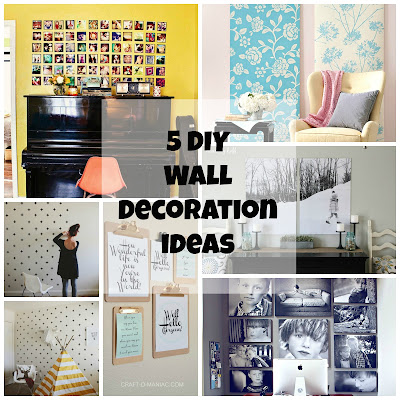
Find the location of `white chairback`. white chairback is located at coordinates (34, 280), (370, 232), (365, 80).